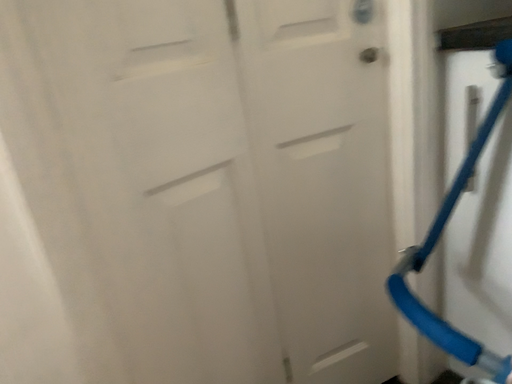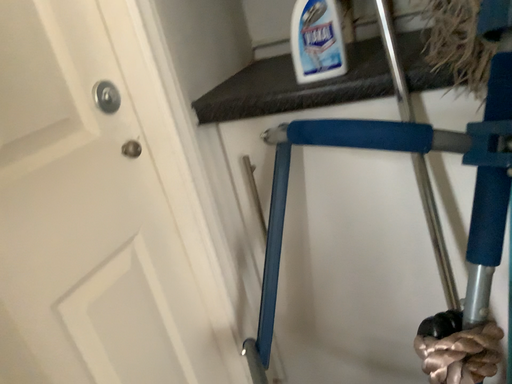
Question: Which way did the camera rotate in the video?

Choices:
 (A) rotated right
 (B) rotated left

Answer: (A)